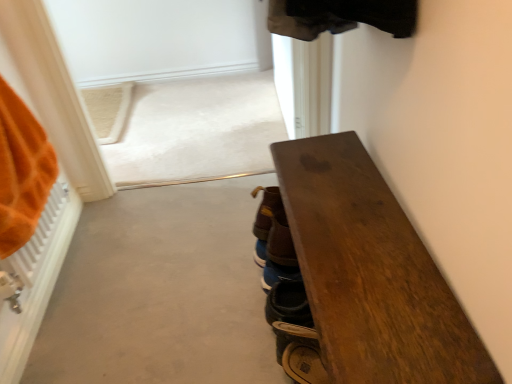
Question: From a real-world perspective, does leather brown shoe at lower center, positioned as the first footwear in front-to-back order, sit lower than brown suede shoes at center, the 3th footwear when ordered from front to back?

Choices:
 (A) no
 (B) yes

Answer: (B)

Question: Considering the relative sizes of leather brown shoe at lower center, positioned as the first footwear in front-to-back order, and brown suede shoes at center, placed as the 1th footwear when sorted from back to front, in the image provided, is leather brown shoe at lower center, positioned as the first footwear in front-to-back order, thinner than brown suede shoes at center, placed as the 1th footwear when sorted from back to front,?

Choices:
 (A) yes
 (B) no

Answer: (B)

Question: Considering the relative sizes of leather brown shoe at lower center, positioned as the first footwear in front-to-back order, and brown suede shoes at center, placed as the 1th footwear when sorted from back to front, in the image provided, is leather brown shoe at lower center, positioned as the first footwear in front-to-back order, smaller than brown suede shoes at center, placed as the 1th footwear when sorted from back to front,?

Choices:
 (A) yes
 (B) no

Answer: (A)

Question: From the image's perspective, is leather brown shoe at lower center, positioned as the first footwear in front-to-back order, beneath brown suede shoes at center, placed as the 1th footwear when sorted from back to front?

Choices:
 (A) yes
 (B) no

Answer: (A)

Question: Can you confirm if leather brown shoe at lower center, the third footwear positioned from the back, is taller than brown suede shoes at center, placed as the 1th footwear when sorted from back to front?

Choices:
 (A) yes
 (B) no

Answer: (B)

Question: Is brown suede shoes at center, placed as the 1th footwear when sorted from back to front, located within leather brown shoe at lower center, positioned as the first footwear in front-to-back order?

Choices:
 (A) yes
 (B) no

Answer: (B)

Question: Does dark wood bench at right have a lesser height compared to leather brown shoe at lower center, positioned as the first footwear in front-to-back order?

Choices:
 (A) no
 (B) yes

Answer: (A)

Question: Can you confirm if dark wood bench at right is positioned to the right of leather brown shoe at lower center, positioned as the first footwear in front-to-back order?

Choices:
 (A) no
 (B) yes

Answer: (B)

Question: Considering the relative sizes of dark wood bench at right and leather brown shoe at lower center, the third footwear positioned from the back, in the image provided, is dark wood bench at right taller than leather brown shoe at lower center, the third footwear positioned from the back,?

Choices:
 (A) yes
 (B) no

Answer: (A)

Question: From the image's perspective, is dark wood bench at right above leather brown shoe at lower center, positioned as the first footwear in front-to-back order?

Choices:
 (A) yes
 (B) no

Answer: (A)

Question: Considering the relative sizes of dark wood bench at right and leather brown shoe at lower center, positioned as the first footwear in front-to-back order, in the image provided, is dark wood bench at right bigger than leather brown shoe at lower center, positioned as the first footwear in front-to-back order,?

Choices:
 (A) yes
 (B) no

Answer: (A)

Question: Does dark wood bench at right have a lesser width compared to leather brown shoe at lower center, the third footwear positioned from the back?

Choices:
 (A) no
 (B) yes

Answer: (A)

Question: Can you confirm if brown suede shoes at center, placed as the 1th footwear when sorted from back to front, is smaller than brown leather shoes at center, which is the second footwear in front-to-back order?

Choices:
 (A) yes
 (B) no

Answer: (A)